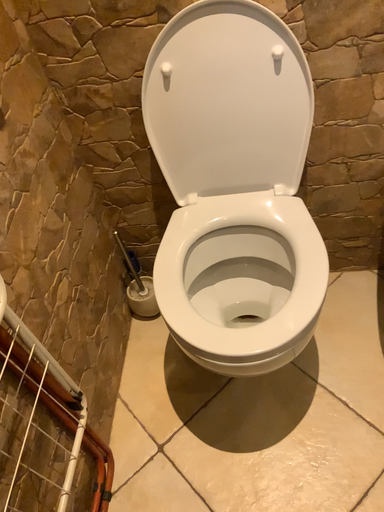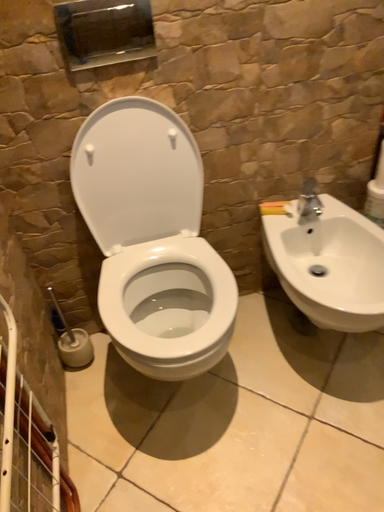
Question: How did the camera likely rotate when shooting the video?

Choices:
 (A) rotated upward
 (B) rotated downward

Answer: (A)